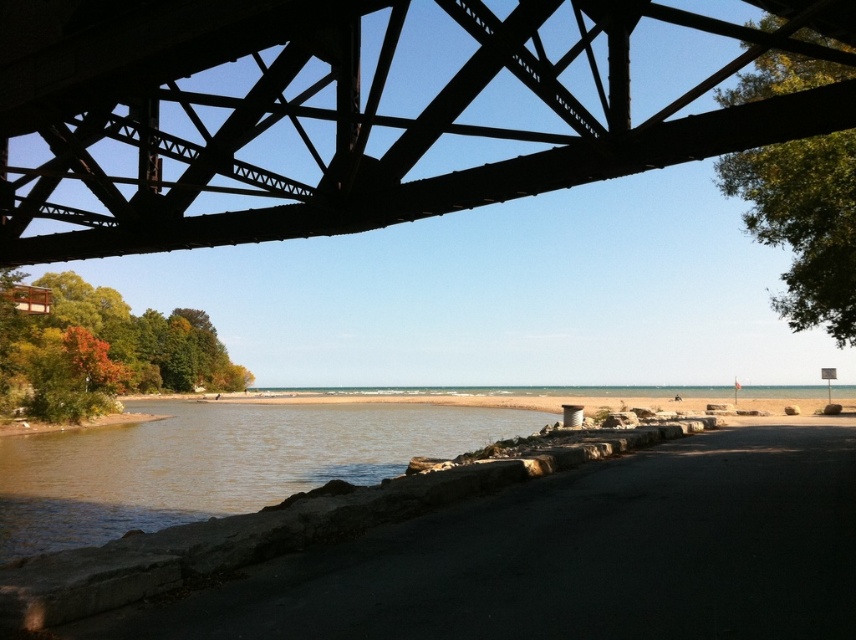
You are a photographer planning to capture the black steel bridge at upper center and the brown stone river at lower left in a single frame. Considering their sizes, which object should you focus on to ensure both are visible without cropping?

Since the black steel bridge at upper center is smaller than the brown stone river at lower left, you should focus on the brown stone river at lower left to ensure both objects are visible in the frame without cropping.

You are a photographer standing on the beach and want to capture both the black steel bridge at upper center and the brown stone river at lower left in a single shot. Based on their positions, which object should you focus on first to ensure both are in the frame?

The black steel bridge at upper center is above the brown stone river at lower left, so you should focus on the brown stone river at lower left first as it is lower in the frame to include both in the shot.